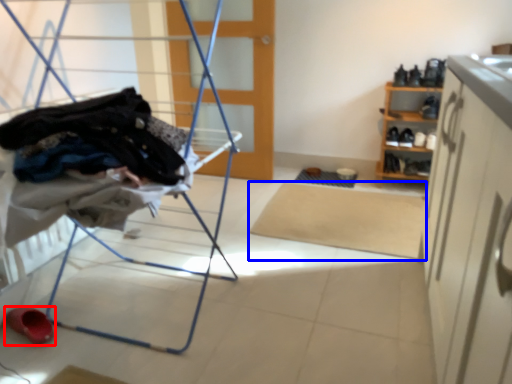
Question: Which of the following is the farthest to the observer, footwear (highlighted by a red box) or mat (highlighted by a blue box)?

Choices:
 (A) footwear
 (B) mat

Answer: (B)